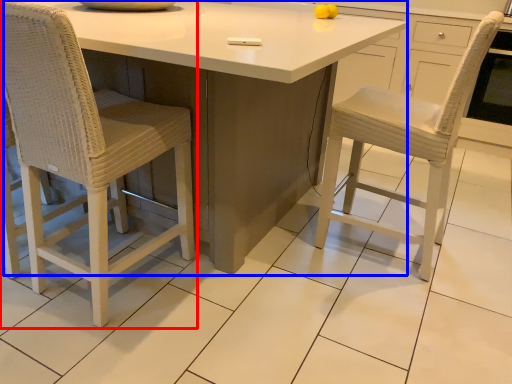
Question: Which point is closer to the camera, chair (highlighted by a red box) or table (highlighted by a blue box)?

Choices:
 (A) chair
 (B) table

Answer: (B)